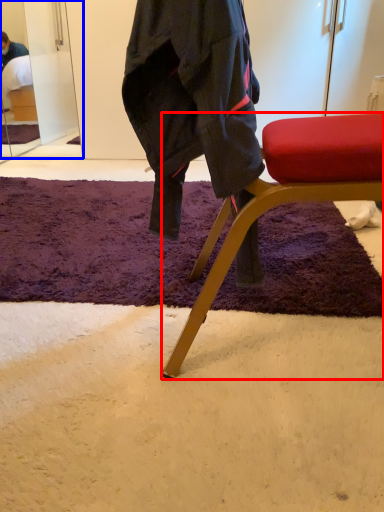
Question: Which point is further to the camera, chair (highlighted by a red box) or mirror (highlighted by a blue box)?

Choices:
 (A) chair
 (B) mirror

Answer: (B)